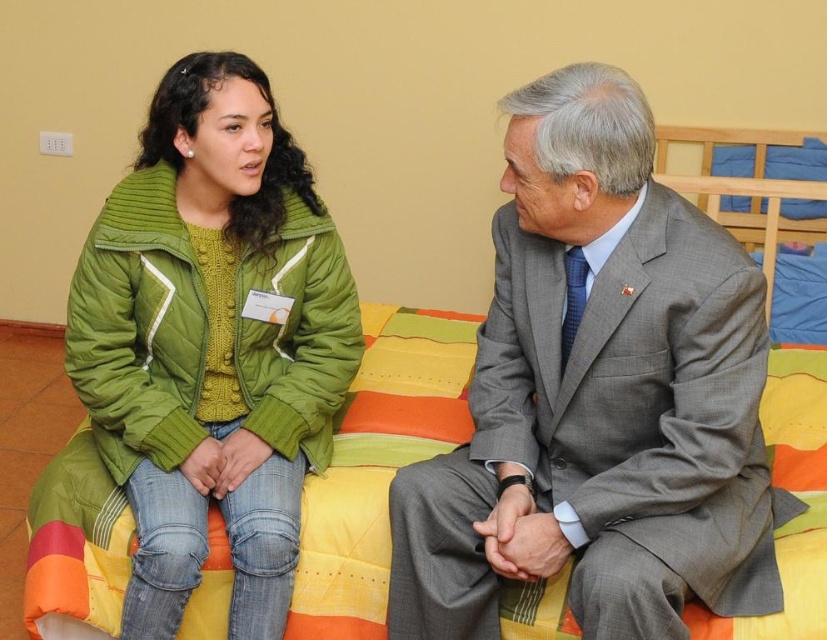
You are a photographer standing in front of the two individuals. You need to take a photo that clearly shows both the gray wool suit at center and the green quilted jacket at upper left. Which of the two should you focus on first to ensure both are in sharp focus?

You should focus on the gray wool suit at center first since it is closer to the viewer than the green quilted jacket at upper left, ensuring both will be in focus when focusing on the closer object.

You are organizing a clothing donation drive and need to determine if the gray wool suit at center and the green quilted jacket at upper left can fit side by side on a shelf that is 1.2 meters wide. Based on their widths, will they both fit?

The gray wool suit at center is wider than the green quilted jacket at upper left. However, without knowing the exact widths of both items, it is impossible to determine if their combined width will fit on a 1.2 meter shelf.